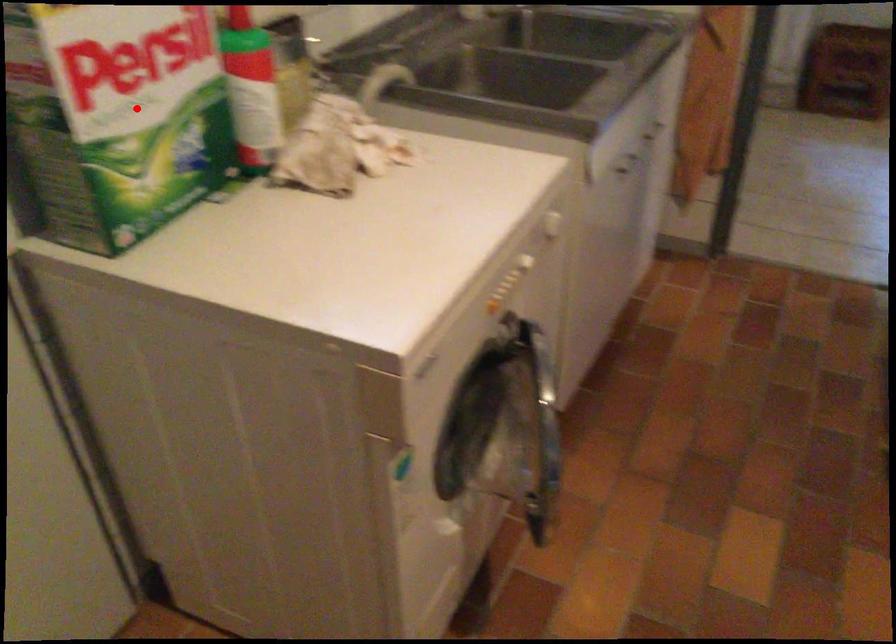
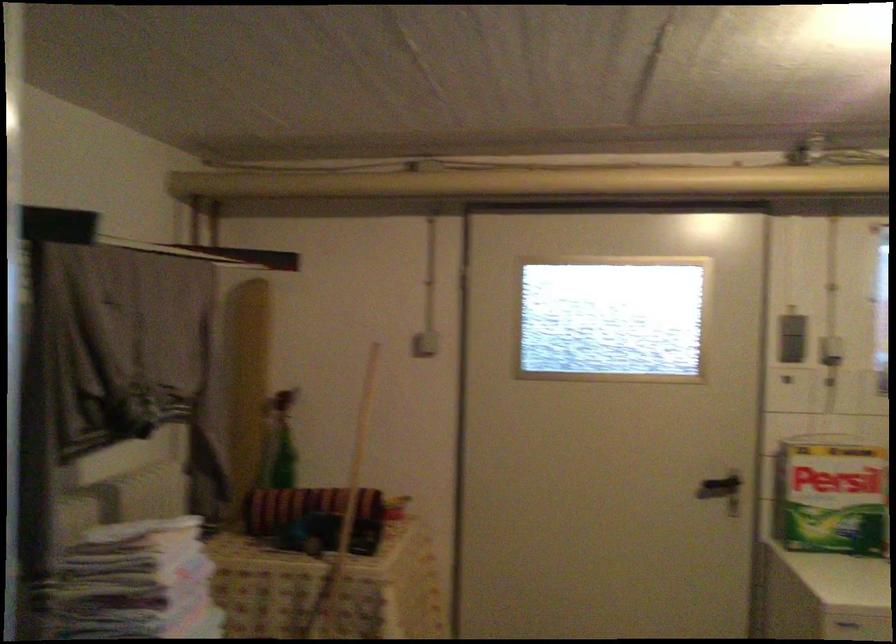
Locate, in the second image, the point that corresponds to the highlighted location in the first image.

(831, 496)